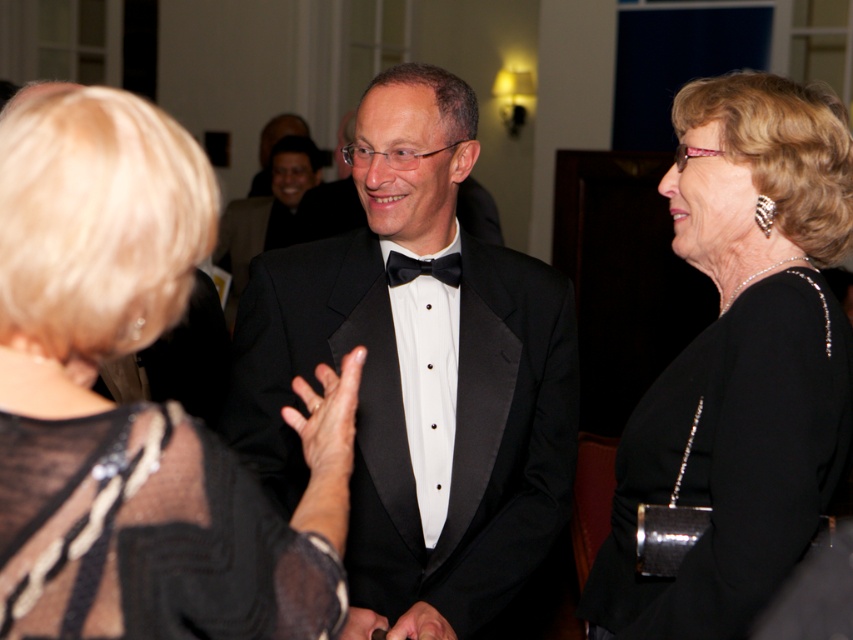
The width and height of the screenshot is (853, 640). What do you see at coordinates (149, 536) in the screenshot? I see `black sheer fabric dress at lower left` at bounding box center [149, 536].

Is point (178, 512) farther from camera compared to point (426, 264)?

No, (178, 512) is closer to viewer.

The image size is (853, 640). Identify the location of black sheer fabric dress at lower left. (149, 536).

Is black satin dress at right below black sheer fabric dress at lower left?

Actually, black satin dress at right is above black sheer fabric dress at lower left.

Does black satin dress at right have a greater width compared to black sheer fabric dress at lower left?

Indeed, black satin dress at right has a greater width compared to black sheer fabric dress at lower left.

Identify the location of black satin dress at right. (740, 364).

Between point (289, 289) and point (432, 275), which one is positioned in front?

Point (289, 289)

In order to click on black satin tuxedo at center in this screenshot , I will do `click(419, 376)`.

Where is `black satin tuxedo at center`? This screenshot has height=640, width=853. black satin tuxedo at center is located at coordinates (419, 376).